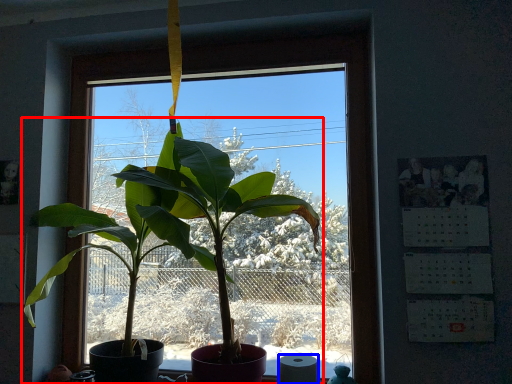
Question: Among these objects, which one is farthest to the camera, houseplant (highlighted by a red box) or toilet paper (highlighted by a blue box)?

Choices:
 (A) houseplant
 (B) toilet paper

Answer: (B)